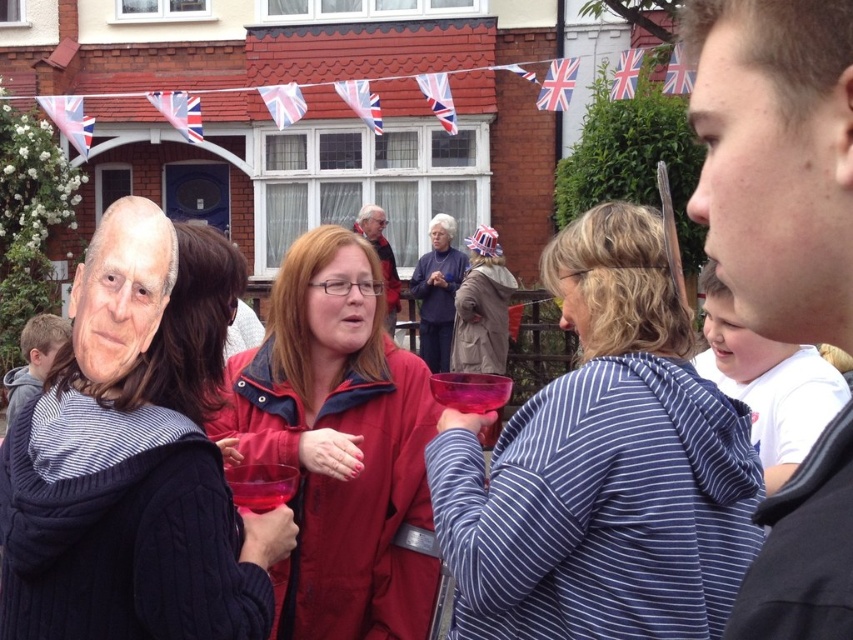
Question: Does striped cotton hoodie at center appear on the right side of red matte jacket at center?

Choices:
 (A) yes
 (B) no

Answer: (A)

Question: Which point is farther to the camera?

Choices:
 (A) smooth skin face at center
 (B) matte brown coat at center
 (C) striped cotton hoodie at center

Answer: (B)

Question: Which point is closer to the camera?

Choices:
 (A) striped cotton hoodie at center
 (B) matte black jacket at center
 (C) red matte jacket at center

Answer: (A)

Question: Does striped cotton hoodie at center have a smaller size compared to matte brown coat at center?

Choices:
 (A) yes
 (B) no

Answer: (B)

Question: Can you confirm if smooth skin face at center is thinner than red matte jacket at center?

Choices:
 (A) yes
 (B) no

Answer: (B)

Question: Which of these objects is positioned farthest from the striped cotton hoodie at center?

Choices:
 (A) matte blue sweater at center
 (B) matte black sweater at center

Answer: (A)